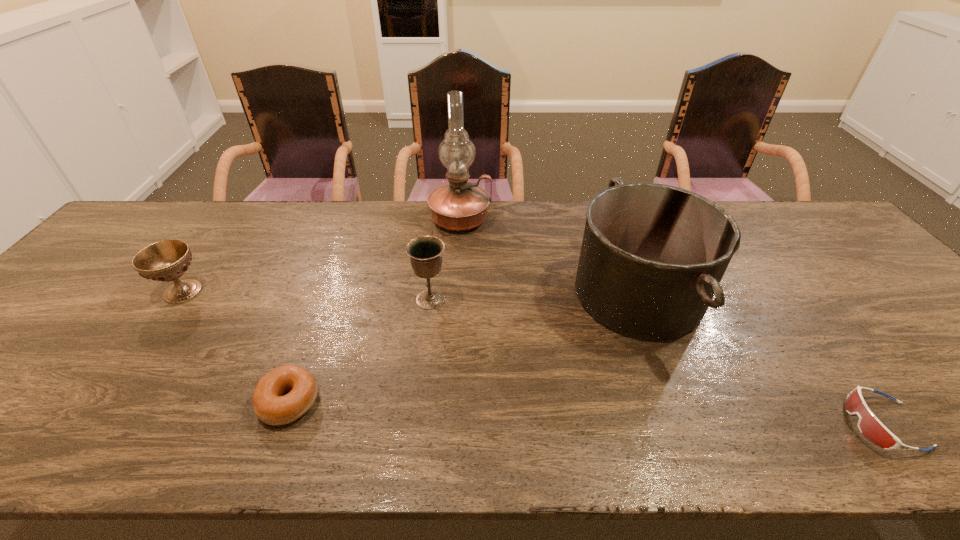
You are a GUI agent. You are given a task and a screenshot of the screen. Output one action in this format:
    pyautogui.click(x=<x>, y=<y>)
    Task: Click on the bagel at the near edge
    This screenshot has width=960, height=540.
    Given the screenshot: What is the action you would take?
    pyautogui.click(x=270, y=406)

The width and height of the screenshot is (960, 540). I want to click on goggles that is at the near edge, so click(x=869, y=425).

Identify the location of vacant space at the far edge of the desktop. (552, 244).

In the image, there is a desktop. Where is `vacant area at the near edge`? This screenshot has width=960, height=540. vacant area at the near edge is located at coordinates (566, 456).

Image resolution: width=960 pixels, height=540 pixels. I want to click on vacant space at the left edge of the desktop, so click(x=32, y=361).

Find the location of a particular element. blank space at the far left corner is located at coordinates pyautogui.click(x=171, y=208).

Locate an element on the screen. vacant space at the far right corner of the desktop is located at coordinates (822, 228).

Where is `free space between the leftmost object and the goggles`? Image resolution: width=960 pixels, height=540 pixels. free space between the leftmost object and the goggles is located at coordinates (533, 358).

Where is `vacant space that is in between the fifth object from left to right and the bagel`? vacant space that is in between the fifth object from left to right and the bagel is located at coordinates pyautogui.click(x=464, y=348).

This screenshot has height=540, width=960. Find the location of `unoccupied position between the right chalice and the bagel`. unoccupied position between the right chalice and the bagel is located at coordinates (360, 350).